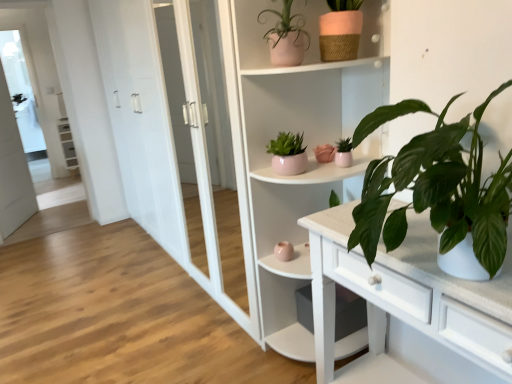
Question: Which direction should I rotate to look at matte pink pot at upper center, the third houseplant from the bottom, — up or down?

Choices:
 (A) down
 (B) up

Answer: (B)

Question: Does white glass screen door at left have a greater width compared to pink woven flowerpot at upper center?

Choices:
 (A) no
 (B) yes

Answer: (A)

Question: Does white glass screen door at left lie in front of pink woven flowerpot at upper center?

Choices:
 (A) no
 (B) yes

Answer: (A)

Question: Does white glass screen door at left have a larger size compared to pink woven flowerpot at upper center?

Choices:
 (A) no
 (B) yes

Answer: (B)

Question: Can we say white glass screen door at left lies outside pink woven flowerpot at upper center?

Choices:
 (A) yes
 (B) no

Answer: (A)

Question: Is white glass screen door at left placed right next to pink woven flowerpot at upper center?

Choices:
 (A) no
 (B) yes

Answer: (A)

Question: Considering the relative sizes of white glass screen door at left and pink woven flowerpot at upper center in the image provided, is white glass screen door at left taller than pink woven flowerpot at upper center?

Choices:
 (A) yes
 (B) no

Answer: (A)

Question: Are white glass screen door at left and green leafy plant at right, which ranks as the first houseplant in bottom-to-top order, located far from each other?

Choices:
 (A) no
 (B) yes

Answer: (B)

Question: Can you confirm if white glass screen door at left is smaller than green leafy plant at right, which is counted as the fourth houseplant, starting from the top?

Choices:
 (A) no
 (B) yes

Answer: (A)

Question: From a real-world perspective, is white glass screen door at left on green leafy plant at right, which is counted as the fourth houseplant, starting from the top?

Choices:
 (A) yes
 (B) no

Answer: (B)

Question: Is white glass screen door at left positioned with its back to green leafy plant at right, which is counted as the fourth houseplant, starting from the top?

Choices:
 (A) no
 (B) yes

Answer: (A)

Question: From the image's perspective, is white glass screen door at left above green leafy plant at right, which is counted as the fourth houseplant, starting from the top?

Choices:
 (A) yes
 (B) no

Answer: (A)

Question: Is white glass screen door at left closer to camera compared to green leafy plant at right, which ranks as the first houseplant in bottom-to-top order?

Choices:
 (A) no
 (B) yes

Answer: (A)

Question: From the image's perspective, is matte pink pot at center, which is counted as the 2th houseplant, starting from the bottom, located above matte pink pot at upper center, which is the 4th houseplant from bottom to top?

Choices:
 (A) yes
 (B) no

Answer: (B)